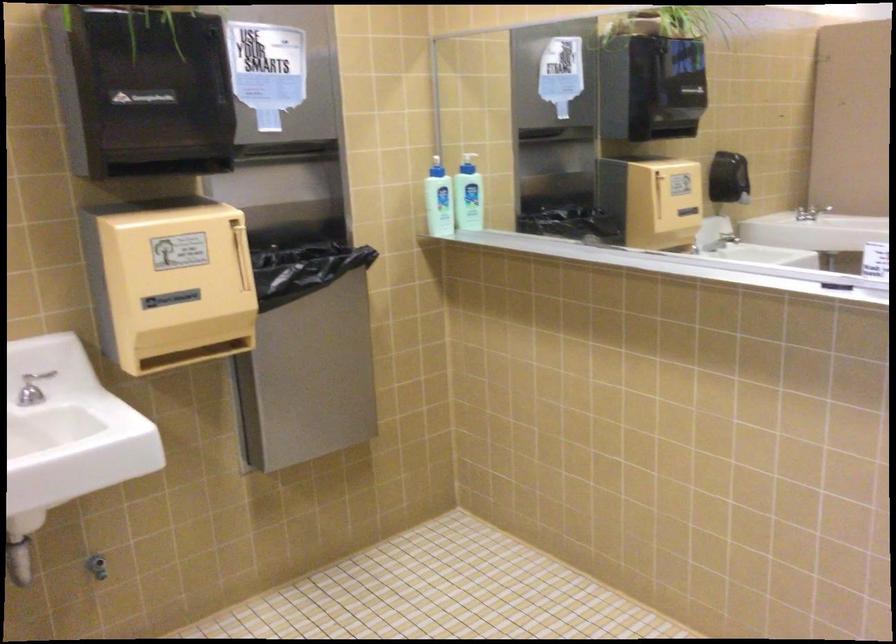
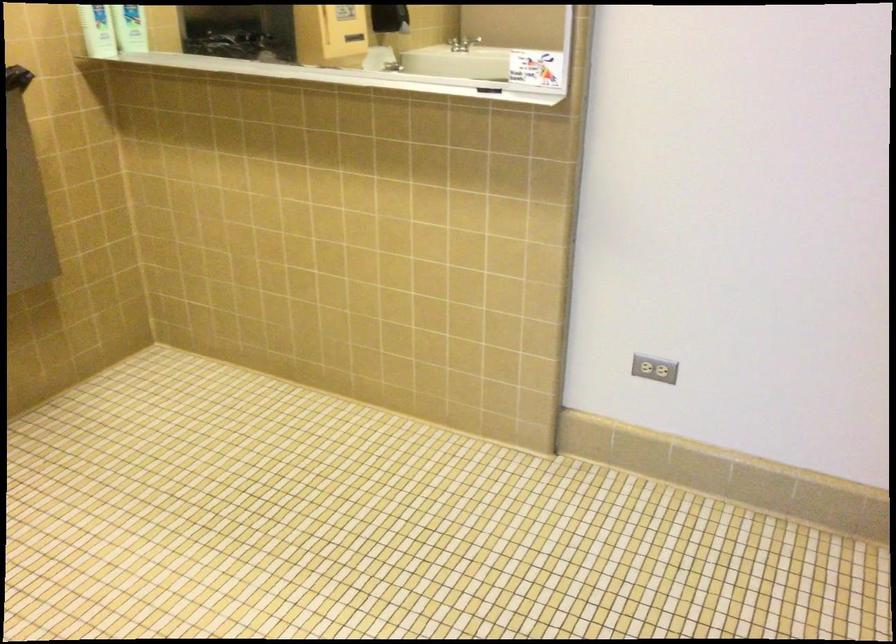
The point at (821, 205) is marked in the first image. Where is the corresponding point in the second image?

(469, 43)